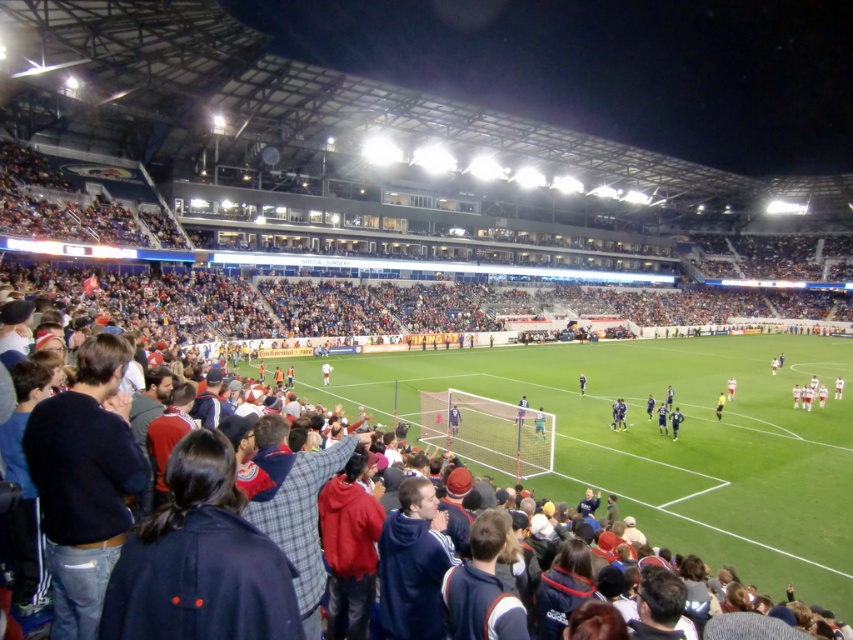
Looking at this image, which is below, light blue jersey at center or white fabric shirt at center?

Positioned lower is light blue jersey at center.

Does light blue jersey at center have a greater width compared to white fabric shirt at center?

No.

The height and width of the screenshot is (640, 853). What are the coordinates of `light blue jersey at center` in the screenshot? It's located at (521, 410).

Which is more to the right, green jersey at center or light blue jersey at center?

From the viewer's perspective, green jersey at center appears more on the right side.

Looking at this image, is green jersey at center positioned in front of light blue jersey at center?

That is False.

Who is more forward, [538,433] or [526,406]?

Positioned in front is point [538,433].

Image resolution: width=853 pixels, height=640 pixels. Identify the location of green jersey at center. (538, 424).

Is dark blue jersey at center to the right of white fabric shirt at center from the viewer's perspective?

Yes, dark blue jersey at center is to the right of white fabric shirt at center.

Is dark blue jersey at center taller than white fabric shirt at center?

Incorrect, dark blue jersey at center's height is not larger of white fabric shirt at center's.

Who is more distant from viewer, (671, 412) or (323, 362)?

The point (323, 362) is behind.

At what (x,y) coordinates should I click in order to perform the action: click on dark blue jersey at center. Please return your answer as a coordinate pair (x, y). Looking at the image, I should click on (675, 420).